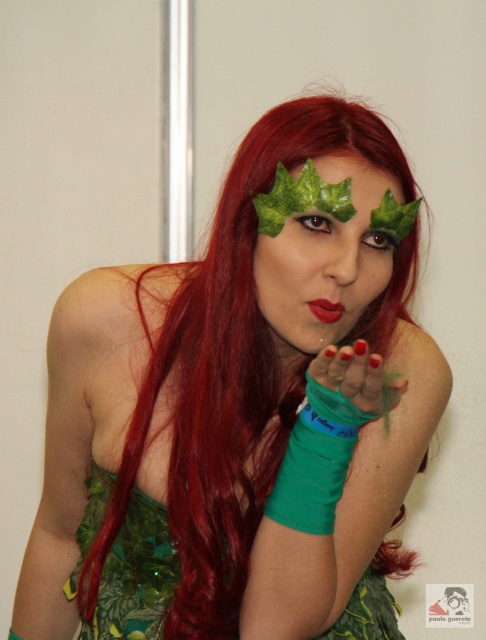
Question: Among these points, which one is nearest to the camera?

Choices:
 (A) (318, 298)
 (B) (285, 307)
 (C) (134, 556)
 (D) (347, 396)

Answer: (D)

Question: Which object is positioned closest to the green matte glove at center?

Choices:
 (A) matte red lipstick at center
 (B) green matte leaf at center
 (C) green fabric dress at center

Answer: (A)

Question: In this image, where is green matte leaf at center located relative to green matte glove at center?

Choices:
 (A) left
 (B) right

Answer: (A)

Question: Which is nearer to the green fabric dress at center?

Choices:
 (A) green matte glove at center
 (B) green matte leaf at center

Answer: (A)

Question: Can you confirm if green matte leaf at center is smaller than green matte glove at center?

Choices:
 (A) yes
 (B) no

Answer: (B)

Question: Does green matte leaf at center appear over green fabric dress at center?

Choices:
 (A) no
 (B) yes

Answer: (B)